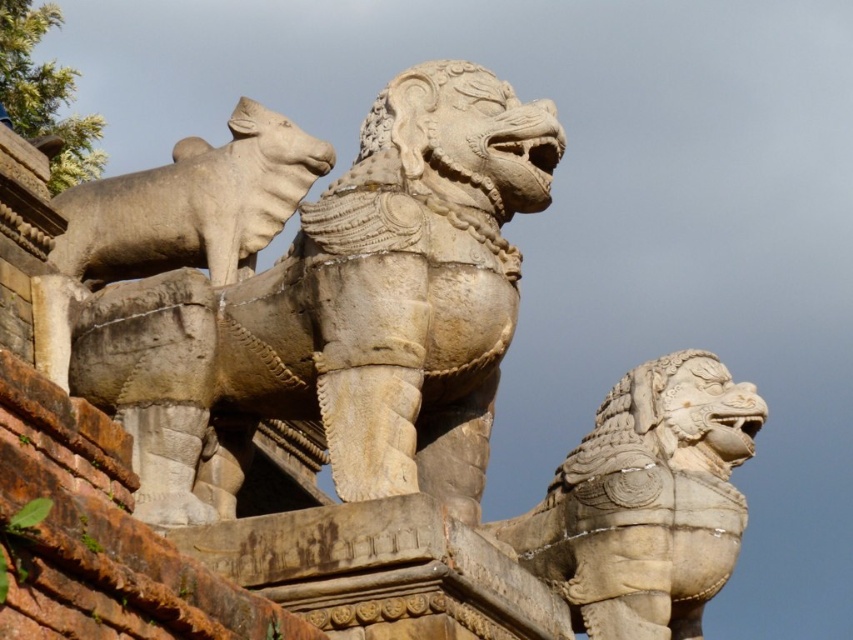
Can you confirm if stone lion at center is positioned above stone lion at right?

Yes, stone lion at center is above stone lion at right.

Which is more to the right, stone lion at center or stone lion at right?

Positioned to the right is stone lion at right.

Where is `stone lion at center`? stone lion at center is located at coordinates (340, 314).

Which is more to the left, stone lion at right or gray stone bull at upper left?

gray stone bull at upper left

Looking at this image, who is positioned more to the right, stone lion at right or gray stone bull at upper left?

stone lion at right

What are the coordinates of `stone lion at right` in the screenshot? It's located at (646, 500).

Does stone lion at center appear over gray stone bull at upper left?

No.

Between stone lion at center and gray stone bull at upper left, which one is positioned higher?

gray stone bull at upper left is higher up.

Which is behind, point (343, 394) or point (190, 144)?

Point (190, 144)

This screenshot has width=853, height=640. Find the location of `stone lion at center`. stone lion at center is located at coordinates (340, 314).